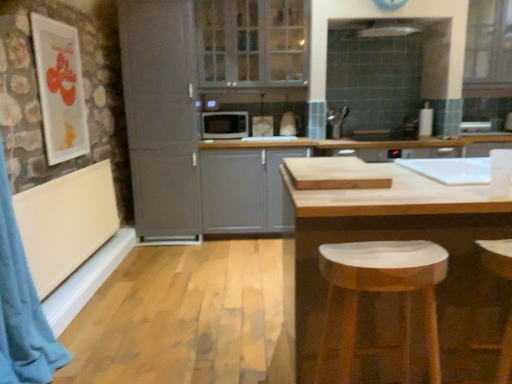
Question: From a real-world perspective, is matte white picture frame at upper left physically above matte gray cabinet at left, the first cabinetry in the left-to-right sequence?

Choices:
 (A) yes
 (B) no

Answer: (A)

Question: Is matte white picture frame at upper left not close to matte gray cabinet at left, the first cabinetry in the left-to-right sequence?

Choices:
 (A) no
 (B) yes

Answer: (A)

Question: Is matte gray cabinet at left, which ranks as the 2th cabinetry in right-to-left order, at the back of matte white picture frame at upper left?

Choices:
 (A) no
 (B) yes

Answer: (A)

Question: Does matte white picture frame at upper left have a greater height compared to matte gray cabinet at left, which ranks as the 2th cabinetry in right-to-left order?

Choices:
 (A) no
 (B) yes

Answer: (A)

Question: From a real-world perspective, does matte white picture frame at upper left sit lower than matte gray cabinet at left, which ranks as the 2th cabinetry in right-to-left order?

Choices:
 (A) no
 (B) yes

Answer: (A)

Question: In the image, is matte white picture frame at upper left on the left side or the right side of natural wood table at center?

Choices:
 (A) right
 (B) left

Answer: (B)

Question: In terms of width, does matte white picture frame at upper left look wider or thinner when compared to natural wood table at center?

Choices:
 (A) wide
 (B) thin

Answer: (B)

Question: Does point (57, 54) appear closer or farther from the camera than point (437, 196)?

Choices:
 (A) farther
 (B) closer

Answer: (A)

Question: Based on their sizes in the image, would you say matte white picture frame at upper left is bigger or smaller than natural wood table at center?

Choices:
 (A) small
 (B) big

Answer: (A)

Question: In terms of height, does white marble stool at lower right look taller or shorter compared to matte white picture frame at upper left?

Choices:
 (A) short
 (B) tall

Answer: (A)

Question: In terms of width, does white marble stool at lower right look wider or thinner when compared to matte white picture frame at upper left?

Choices:
 (A) thin
 (B) wide

Answer: (B)

Question: From a real-world perspective, is white marble stool at lower right above or below matte white picture frame at upper left?

Choices:
 (A) below
 (B) above

Answer: (A)

Question: Is point (428, 322) positioned closer to the camera than point (49, 43)?

Choices:
 (A) closer
 (B) farther

Answer: (A)

Question: From the image's perspective, relative to white marble stool at lower right, is matte gray cabinet at center, positioned as the first cabinetry in right-to-left order, above or below?

Choices:
 (A) above
 (B) below

Answer: (A)

Question: Is matte gray cabinet at center, the second cabinetry from the left, inside the boundaries of white marble stool at lower right, or outside?

Choices:
 (A) outside
 (B) inside

Answer: (A)